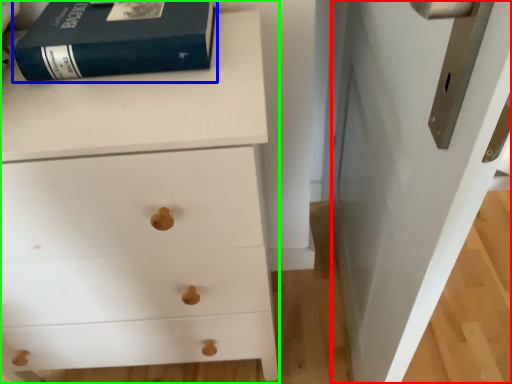
Question: Which is farther away from door (highlighted by a red box)? paperback book (highlighted by a blue box) or chest of drawers (highlighted by a green box)?

Choices:
 (A) paperback book
 (B) chest of drawers

Answer: (A)